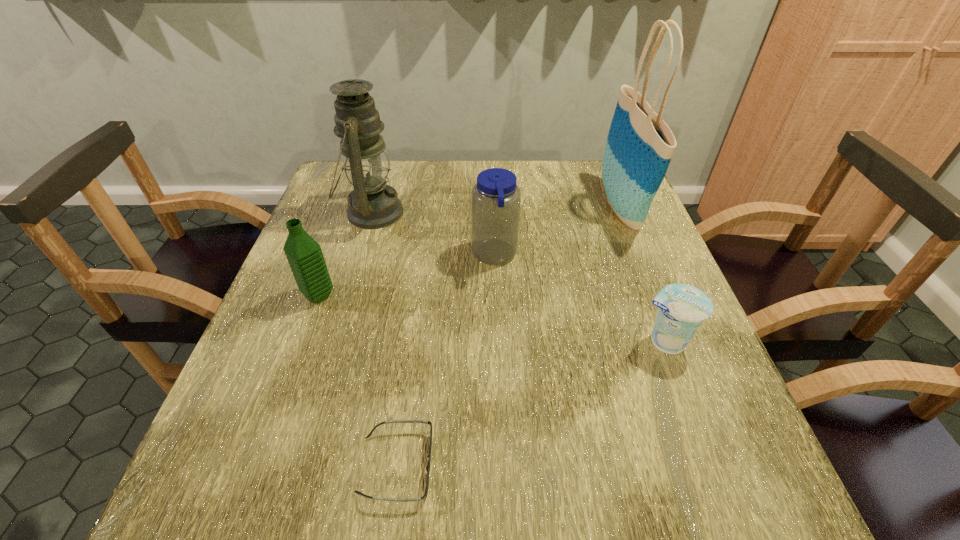
The height and width of the screenshot is (540, 960). I want to click on unoccupied position between the left water bottle and the yogurt, so click(492, 318).

This screenshot has height=540, width=960. Find the location of `vacant point located between the fifth tallest object and the oil lamp`. vacant point located between the fifth tallest object and the oil lamp is located at coordinates (518, 277).

Locate an element on the screen. Image resolution: width=960 pixels, height=540 pixels. vacant region between the tallest object and the fourth farthest object is located at coordinates (469, 251).

Locate which object is the fourth closest to the second nearest object. Please provide its 2D coordinates. Your answer should be formatted as a tuple, i.e. [(x, y)], where the tuple contains the x and y coordinates of a point satisfying the conditions above.

[(372, 204)]

Identify which object is the fifth nearest to the second tallest object. Please provide its 2D coordinates. Your answer should be formatted as a tuple, i.e. [(x, y)], where the tuple contains the x and y coordinates of a point satisfying the conditions above.

[(682, 308)]

Where is `free spot that satisfies the following two spatial constraints: 1. with a carrying loop on the side of the yogurt; 2. on the right side of the fourth object from left to right`? The width and height of the screenshot is (960, 540). free spot that satisfies the following two spatial constraints: 1. with a carrying loop on the side of the yogurt; 2. on the right side of the fourth object from left to right is located at coordinates (498, 341).

Identify the location of vacant area that satisfies the following two spatial constraints: 1. on the back side of the second tallest object; 2. on the right side of the tote bag. Image resolution: width=960 pixels, height=540 pixels. (374, 206).

Identify the location of vacant space that satisfies the following two spatial constraints: 1. on the front side of the tallest object; 2. on the front-facing side of the sunglasses. (722, 465).